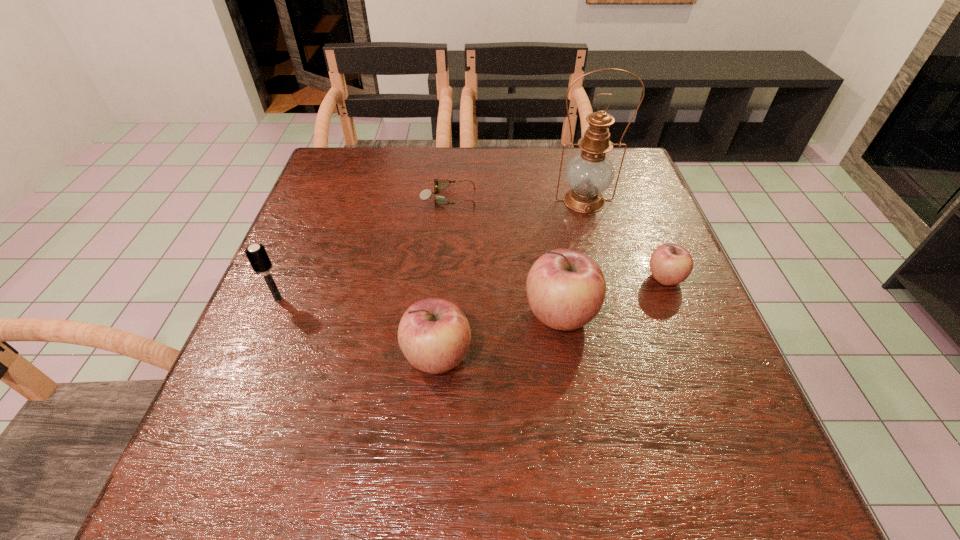
Image resolution: width=960 pixels, height=540 pixels. Find the location of `vacant region at the far edge of the desktop`. vacant region at the far edge of the desktop is located at coordinates (517, 192).

Find the location of a particular element. The height and width of the screenshot is (540, 960). vacant space at the left edge is located at coordinates (350, 194).

Locate an element on the screen. blank space at the right edge is located at coordinates (662, 301).

You are a GUI agent. You are given a task and a screenshot of the screen. Output one action in this format:
    pyautogui.click(x=<x>, y=<y>)
    Task: Click on the vacant point at the far left corner
    The width and height of the screenshot is (960, 540).
    Given the screenshot: What is the action you would take?
    pyautogui.click(x=353, y=187)

In the image, there is a desktop. Where is `vacant region at the near left corner`? vacant region at the near left corner is located at coordinates (253, 401).

Where is `blank space at the far right corner`? This screenshot has width=960, height=540. blank space at the far right corner is located at coordinates (627, 169).

Locate an element on the screen. The height and width of the screenshot is (540, 960). free spot between the second apple from right to left and the rightmost apple is located at coordinates (612, 296).

At what (x,y) coordinates should I click in order to perform the action: click on unoccupied position between the second tallest apple and the second apple from left to right. Please return your answer as a coordinate pair (x, y). Looking at the image, I should click on (498, 336).

This screenshot has height=540, width=960. I want to click on free space between the oil lamp and the rightmost apple, so click(x=624, y=240).

Where is `vacant region between the second apple from right to left and the shortest object`? vacant region between the second apple from right to left and the shortest object is located at coordinates (504, 256).